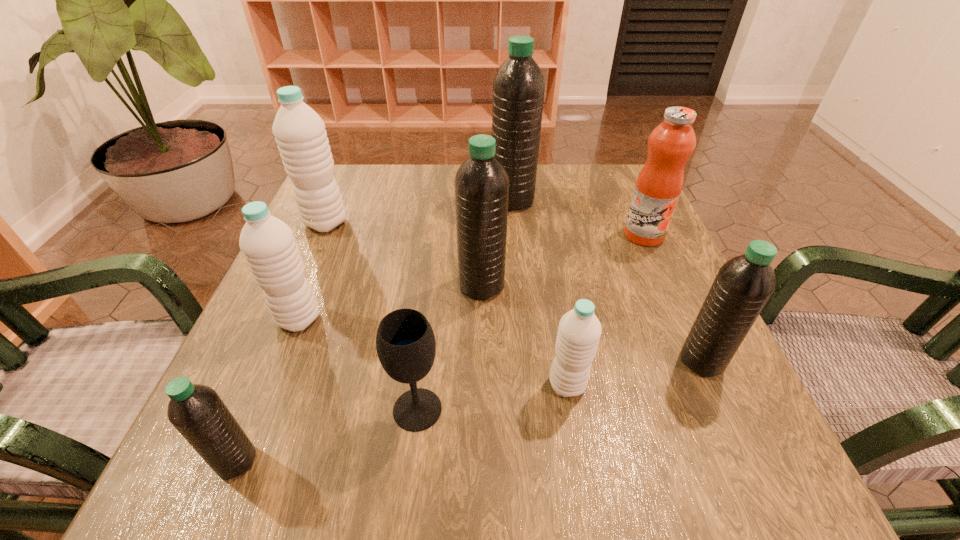
The image size is (960, 540). I want to click on free space located on the front of the second smallest black water bottle, so click(759, 490).

Where is `free space located 0.230m on the left of the fourth object from left to right`? The image size is (960, 540). free space located 0.230m on the left of the fourth object from left to right is located at coordinates (239, 409).

You are a GUI agent. You are given a task and a screenshot of the screen. Output one action in this format:
    pyautogui.click(x=<x>, y=<y>)
    Task: Click on the vacant space positioned 0.280m on the right of the nearest object
    
    Given the screenshot: What is the action you would take?
    pyautogui.click(x=461, y=461)

At what (x,y) coordinates should I click in order to perform the action: click on vacant space located 0.150m on the left of the rightmost white water bottle. Please return your answer as a coordinate pair (x, y). The image size is (960, 540). Looking at the image, I should click on (453, 385).

Identify the location of wineglass present at the near edge. The width and height of the screenshot is (960, 540). (405, 342).

This screenshot has height=540, width=960. I want to click on water bottle situated at the near edge, so click(198, 413).

Locate an element on the screen. The width and height of the screenshot is (960, 540). fruit juice positioned at the right edge is located at coordinates (659, 184).

This screenshot has height=540, width=960. What are the coordinates of `water bottle that is at the right edge` in the screenshot? It's located at (743, 285).

Find the location of a particular element. object that is at the far left corner is located at coordinates (300, 134).

You are a GUI agent. You are given a task and a screenshot of the screen. Output one action in this format:
    pyautogui.click(x=<x>, y=<y>)
    Task: Click on the object located in the near left corner section of the desktop
    The image size is (960, 540).
    Given the screenshot: What is the action you would take?
    pyautogui.click(x=198, y=413)